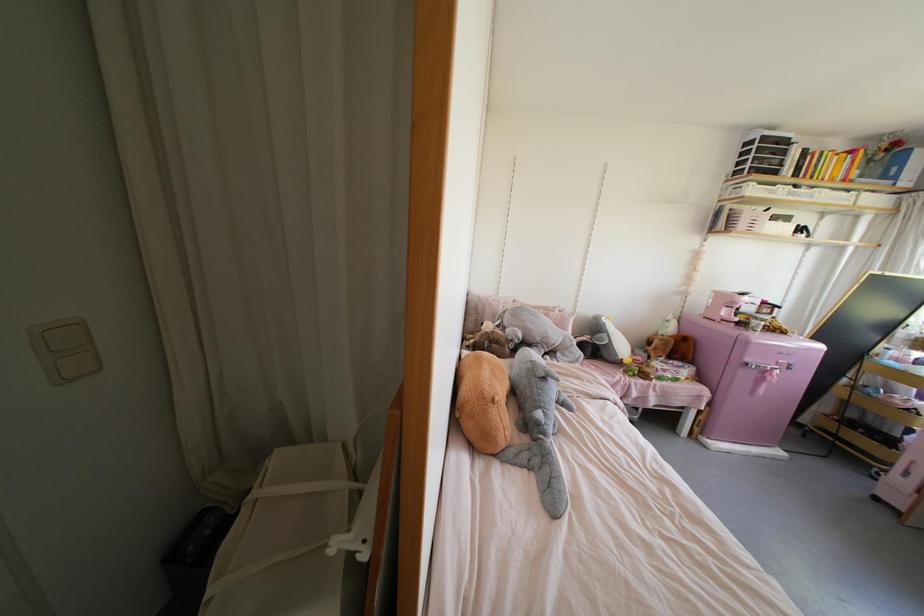
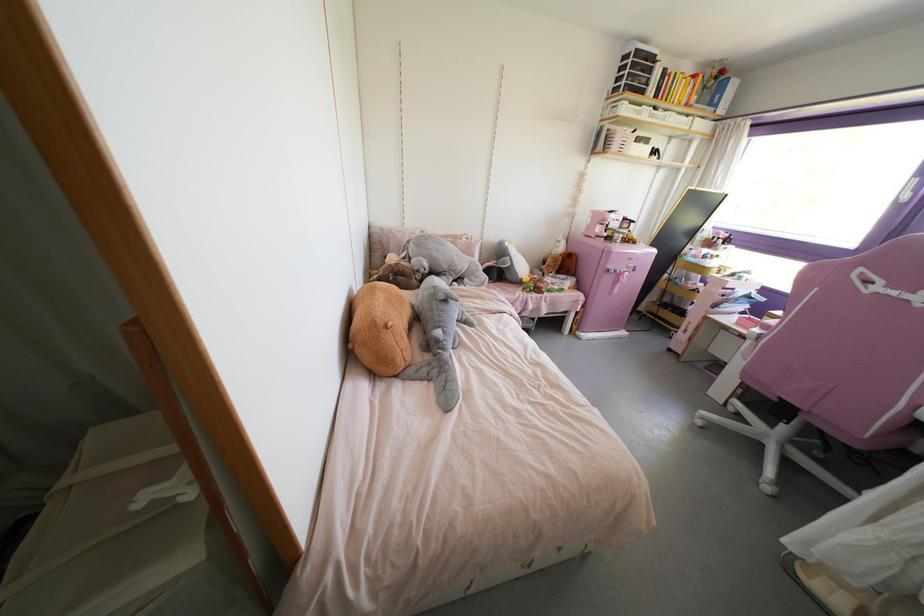
Locate, in the second image, the point that corresponds to (x=786, y=368) in the first image.

(633, 270)